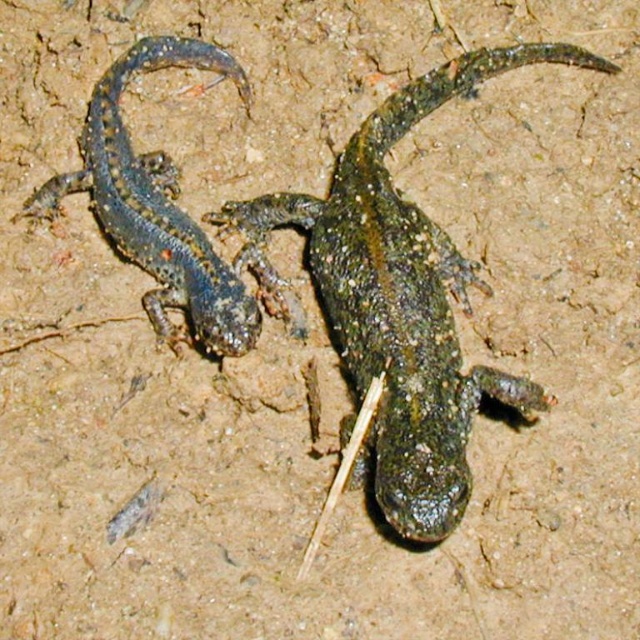
Between green scaly lizard at center and shiny blue lizard at left, which one has less height?

shiny blue lizard at left

Is green scaly lizard at center above shiny blue lizard at left?

No.

Between point (461, 268) and point (248, 332), which one is positioned in front?

Point (248, 332)

What are the coordinates of `green scaly lizard at center` in the screenshot? It's located at (401, 298).